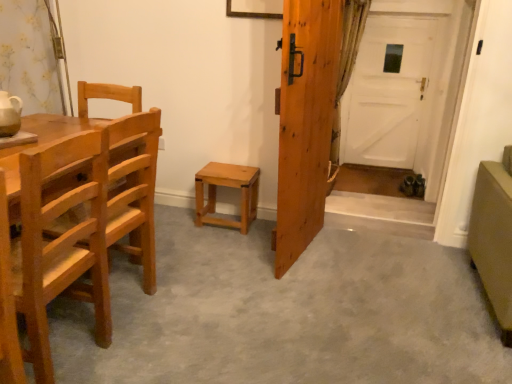
Locate an element on the screen. The image size is (512, 384). free space to the back side of light brown wood chair at left, which is counted as the 1th chair, starting from the back is located at coordinates (155, 260).